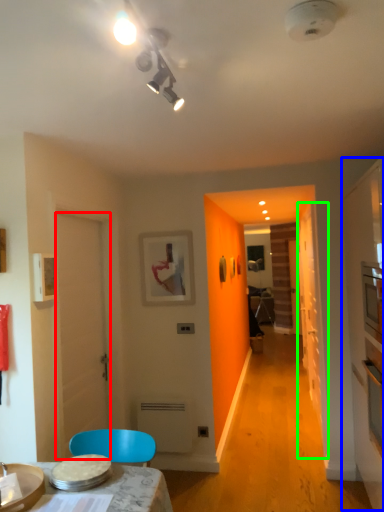
Question: Which object is the farthest from door (highlighted by a red box)? Choose among these: dresser (highlighted by a blue box) or glass door (highlighted by a green box).

Choices:
 (A) dresser
 (B) glass door

Answer: (B)